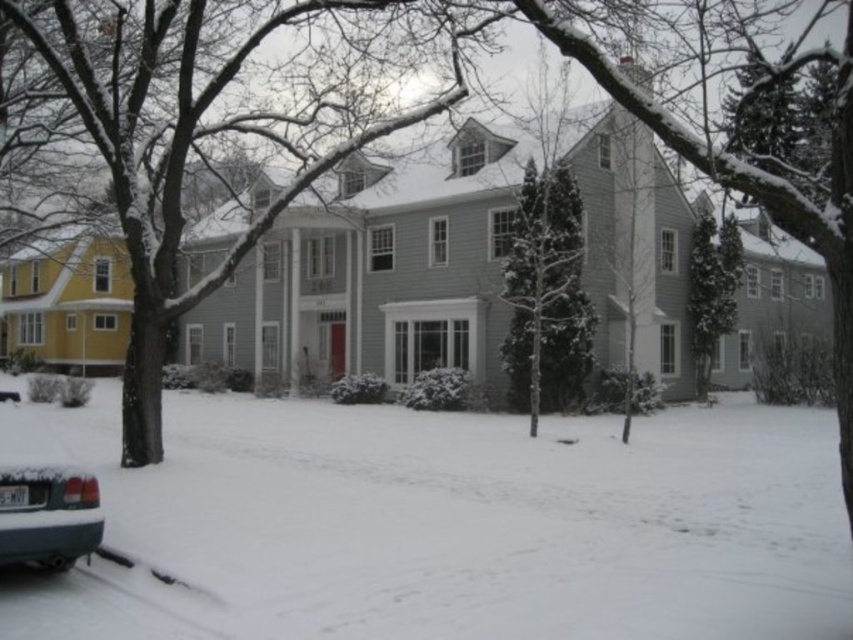
Is snow-covered evergreen tree at center to the left of green textured evergreen tree at right from the viewer's perspective?

Correct, you'll find snow-covered evergreen tree at center to the left of green textured evergreen tree at right.

Image resolution: width=853 pixels, height=640 pixels. What are the coordinates of `snow-covered evergreen tree at center` in the screenshot? It's located at (753, 189).

Which is behind, point (357, 138) or point (695, 244)?

Positioned behind is point (695, 244).

Does snow-covered tree at center have a lesser width compared to green textured evergreen tree at right?

Incorrect, snow-covered tree at center's width is not less than green textured evergreen tree at right's.

Locate an element on the screen. snow-covered tree at center is located at coordinates (225, 122).

What do you see at coordinates (457, 525) in the screenshot? I see `white fluffy snow at lower left` at bounding box center [457, 525].

Locate an element on the screen. Image resolution: width=853 pixels, height=640 pixels. white fluffy snow at lower left is located at coordinates (457, 525).